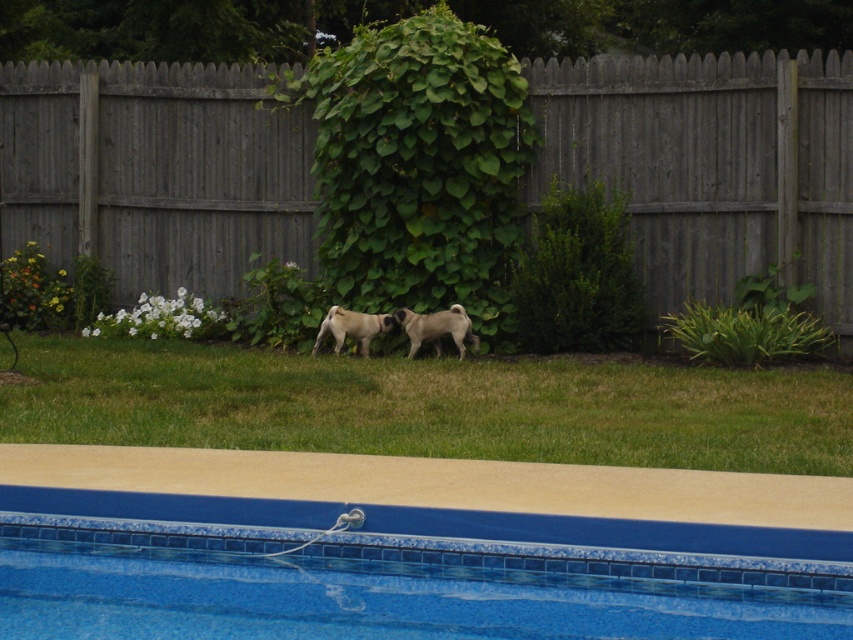
Which is above, green grass at center or gray fur pug at center?

gray fur pug at center is higher up.

Where is `green grass at center`? green grass at center is located at coordinates pyautogui.click(x=431, y=404).

Can you confirm if blue tile swimming pool at lower center is smaller than green grass at center?

Actually, blue tile swimming pool at lower center might be larger than green grass at center.

Between blue tile swimming pool at lower center and green grass at center, which one is positioned higher?

green grass at center

Describe the element at coordinates (398, 572) in the screenshot. I see `blue tile swimming pool at lower center` at that location.

Identify the location of blue tile swimming pool at lower center. This screenshot has height=640, width=853. point(398,572).

Who is more forward, [125,248] or [19,600]?

Positioned in front is point [19,600].

Does point (218, 250) come closer to viewer compared to point (662, 556)?

No, (218, 250) is further to viewer.

The width and height of the screenshot is (853, 640). Find the location of `gray wood fence at center`. gray wood fence at center is located at coordinates (711, 166).